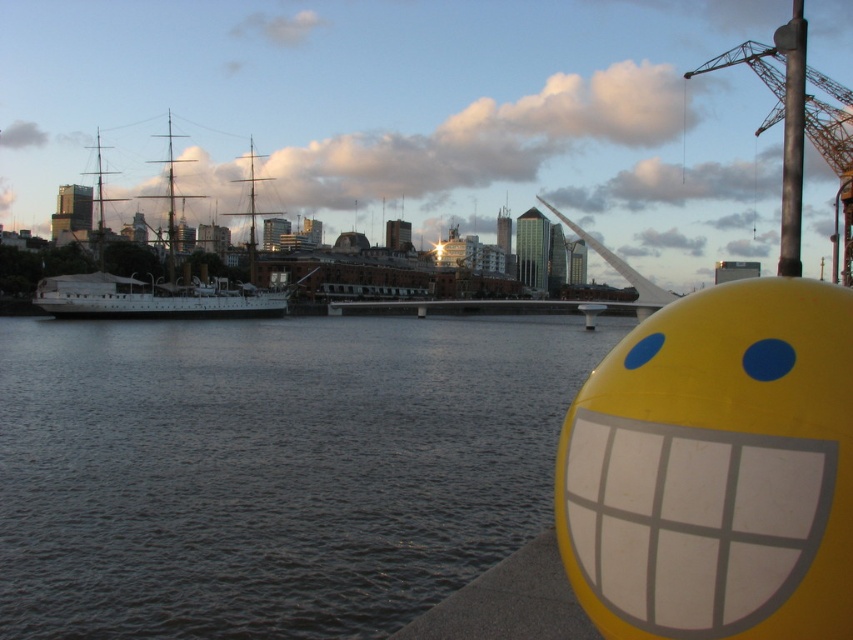
You are standing on a dock looking at the white wooden ship at left and the rusty metal pole at upper right. Which object is positioned higher in the scene?

The rusty metal pole at upper right is positioned higher than the white wooden ship at left.